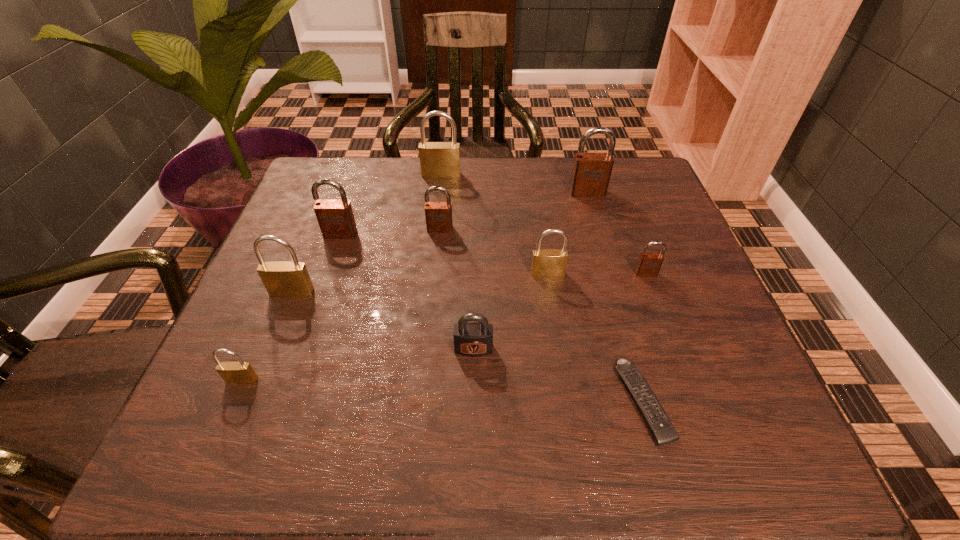
At what (x,y) coordinates should I click in order to perform the action: click on object that is at the near right corner. Please return your answer as a coordinate pair (x, y). This screenshot has width=960, height=540. Looking at the image, I should click on (663, 431).

This screenshot has width=960, height=540. In the image, there is a desktop. Find the location of `free space at the far edge`. free space at the far edge is located at coordinates (474, 184).

Image resolution: width=960 pixels, height=540 pixels. In the image, there is a desktop. In order to click on free space at the near edge in this screenshot , I will do pos(484,458).

Where is `free spot at the left edge of the desktop`? free spot at the left edge of the desktop is located at coordinates (318, 226).

Where is `free region at the right edge`? The image size is (960, 540). free region at the right edge is located at coordinates (723, 348).

In the image, there is a desktop. Where is `vacant region at the far left corner`? vacant region at the far left corner is located at coordinates (334, 159).

In the image, there is a desktop. Where is `vacant space at the far right corner`? vacant space at the far right corner is located at coordinates (642, 174).

Locate an element on the screen. vacant area that lies between the rightmost object and the shortest object is located at coordinates coord(644,338).

You are a GUI agent. You are given a task and a screenshot of the screen. Output one action in this format:
    pyautogui.click(x=<x>, y=<y>)
    Task: Click on the free space between the second smallest brown padlock and the second nearest brass padlock
    
    Given the screenshot: What is the action you would take?
    pyautogui.click(x=366, y=261)

At what (x,y) coordinates should I click in order to perform the action: click on vacant region between the eighth farthest padlock and the second smallest brown padlock. Please return your answer as a coordinate pair (x, y). The image size is (960, 540). Looking at the image, I should click on (457, 289).